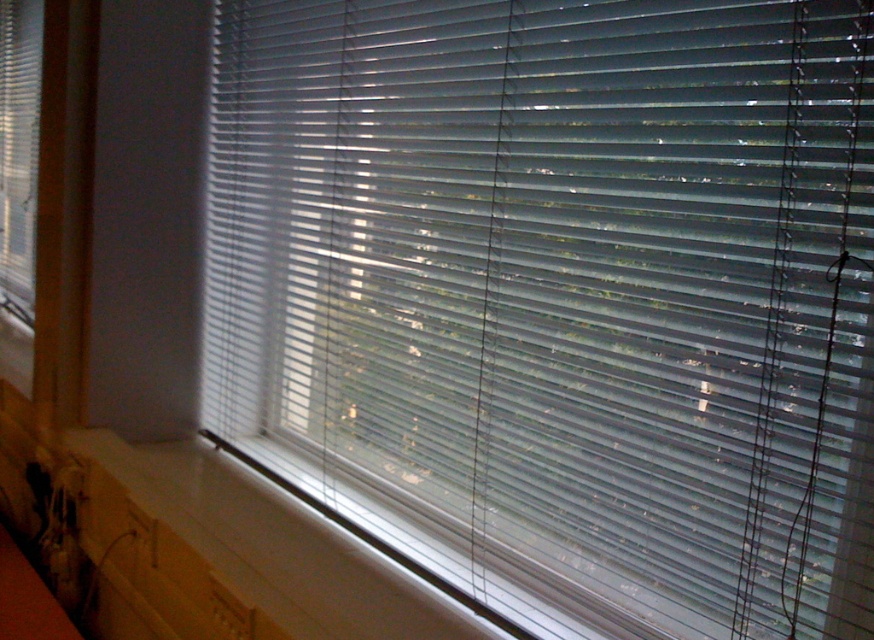
Question: Where is white plastic window sill at lower center located in relation to clear plastic blinds at left in the image?

Choices:
 (A) right
 (B) left

Answer: (A)

Question: Among these points, which one is nearest to the camera?

Choices:
 (A) (191, 516)
 (B) (12, 202)

Answer: (A)

Question: Is white plastic window sill at lower center to the right of clear plastic blinds at left from the viewer's perspective?

Choices:
 (A) yes
 (B) no

Answer: (A)

Question: Is white plastic window sill at lower center positioned behind clear plastic blinds at left?

Choices:
 (A) yes
 (B) no

Answer: (B)